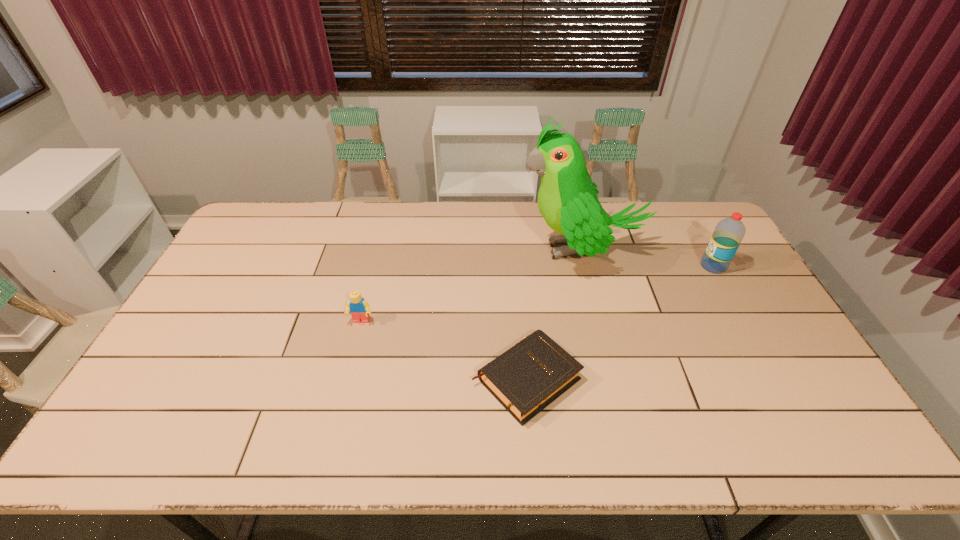
This screenshot has width=960, height=540. What are the coordinates of `the tallest object` in the screenshot? It's located at (567, 199).

Find the location of a particular element. Image resolution: width=960 pixels, height=540 pixels. the second tallest object is located at coordinates (728, 234).

Locate an element on the screen. This screenshot has width=960, height=540. water bottle is located at coordinates (728, 234).

Locate an element on the screen. the third farthest object is located at coordinates (359, 308).

Locate an element on the screen. the leftmost object is located at coordinates (359, 308).

The height and width of the screenshot is (540, 960). I want to click on the shortest object, so click(525, 379).

The height and width of the screenshot is (540, 960). I want to click on the nearest object, so click(525, 379).

The width and height of the screenshot is (960, 540). What are the coordinates of `vacant space situated on the beak of the tallest object` in the screenshot? It's located at (418, 249).

Where is `vacant area located on the beak of the tallest object`? The height and width of the screenshot is (540, 960). vacant area located on the beak of the tallest object is located at coordinates (468, 249).

This screenshot has width=960, height=540. Identify the location of free space located on the beak of the tallest object. tap(433, 249).